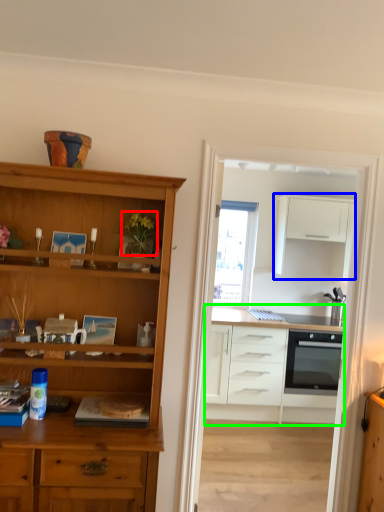
Question: Based on their relative distances, which object is nearer to plant (highlighted by a red box)? Choose from cabinetry (highlighted by a blue box) and cabinetry (highlighted by a green box).

Choices:
 (A) cabinetry
 (B) cabinetry

Answer: (B)